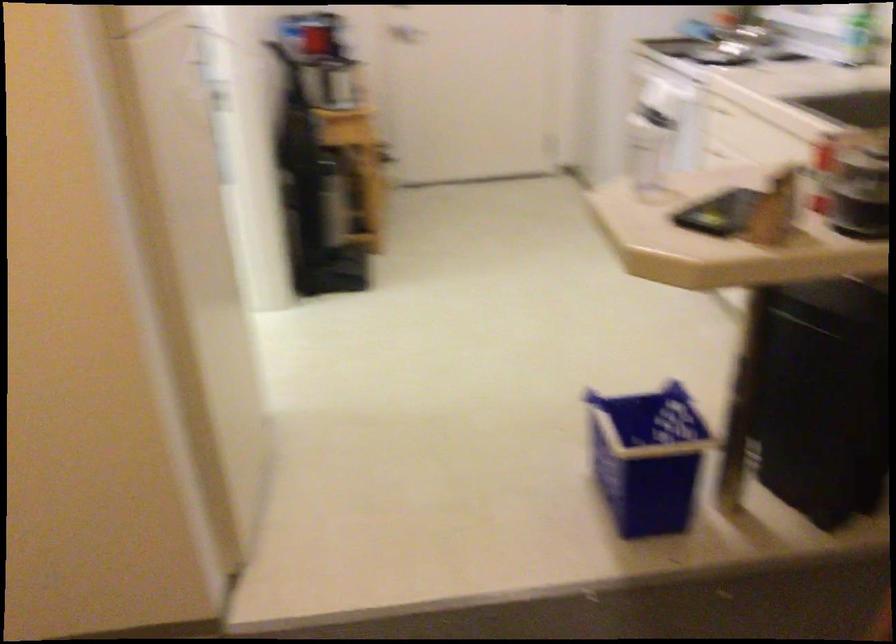
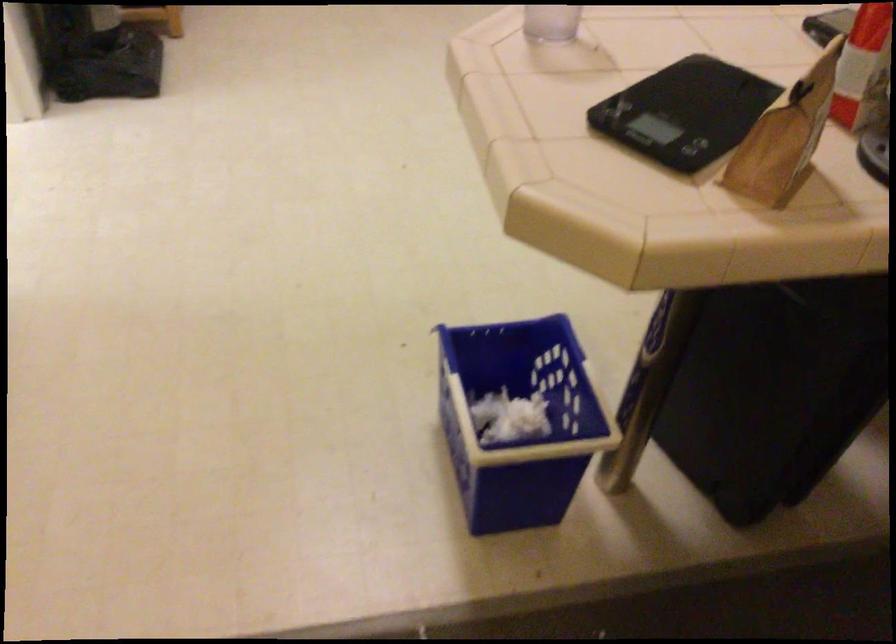
Where in the second image is the point corresponding to (645,173) from the first image?

(550, 23)